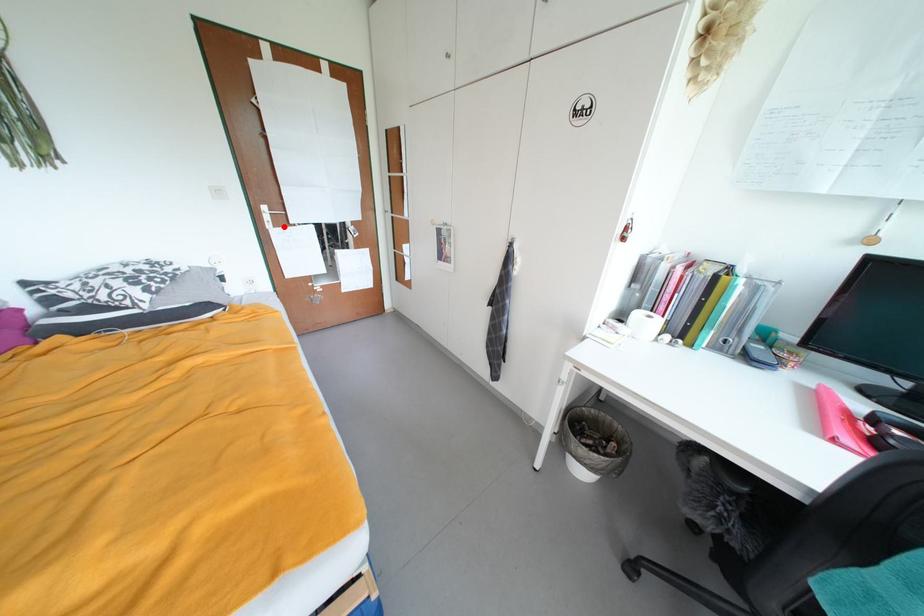
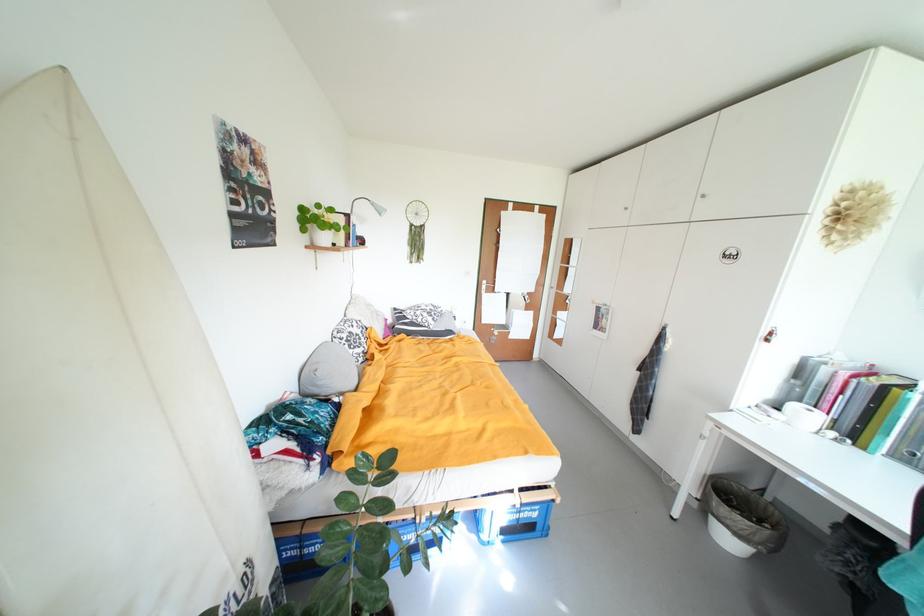
Find the pixel in the second image that matches the highlighted location in the first image.

(494, 294)